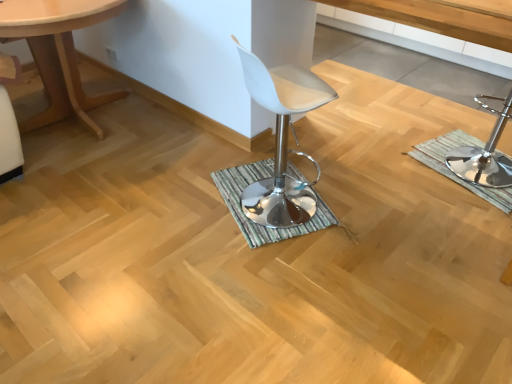
The height and width of the screenshot is (384, 512). In order to click on vacant area that is in front of white plastic stool at center in this screenshot , I will do `click(368, 290)`.